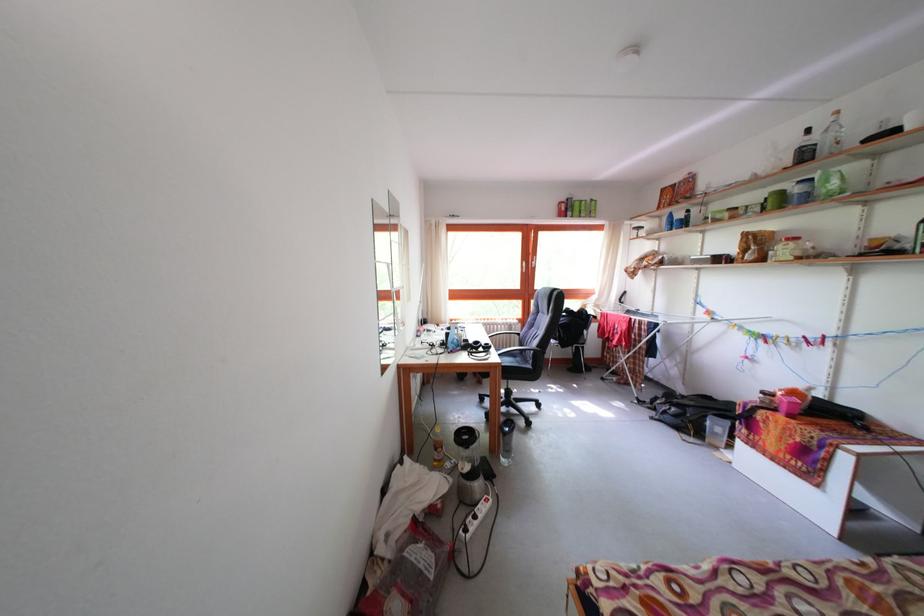
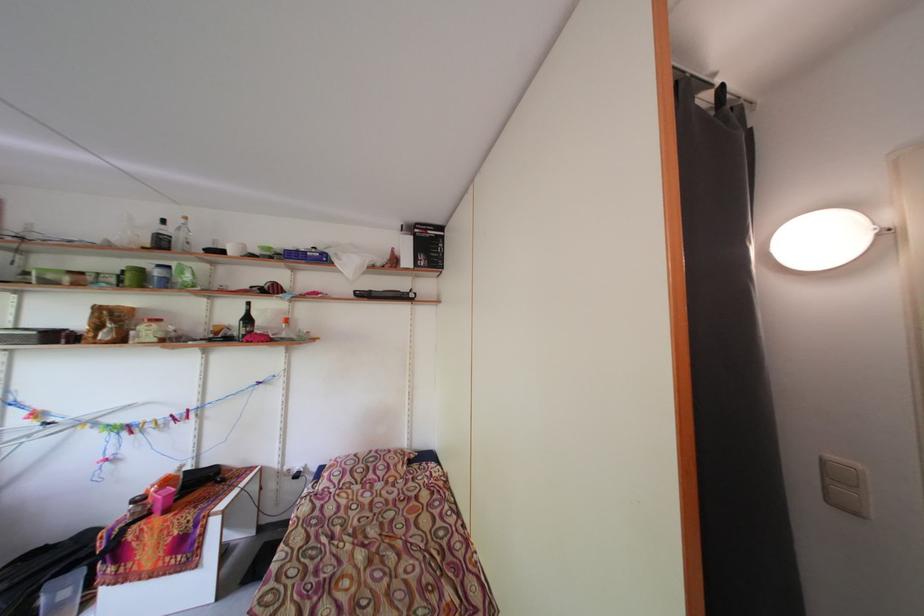
Question: I am providing you with two images of the same scene from different viewpoints. After the viewpoint changes to image2, which objects are now occluded?

Choices:
 (A) small clothespin
 (B) dark curtain
 (C) black wine bottle
 (D) none of these

Answer: (D)